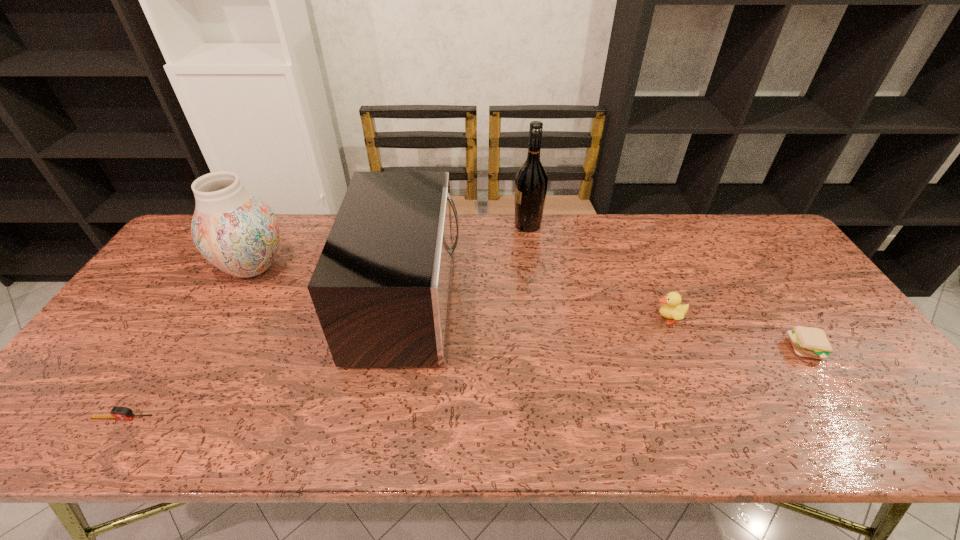
Where is `wine bottle present at the far edge`? The height and width of the screenshot is (540, 960). wine bottle present at the far edge is located at coordinates (531, 181).

The height and width of the screenshot is (540, 960). I want to click on vase at the far edge, so click(237, 232).

Identify the location of microwave oven positioned at the far edge. (381, 288).

Find the location of a particular element. object that is positioned at the near edge is located at coordinates (120, 413).

Locate an element on the screen. object present at the left edge is located at coordinates click(x=120, y=413).

The height and width of the screenshot is (540, 960). Identify the location of object that is at the right edge. (810, 342).

Identify the location of object that is at the near left corner. (120, 413).

Locate an element on the screen. free region at the far edge of the desktop is located at coordinates (565, 242).

Where is `free region at the near edge of the desktop`? The image size is (960, 540). free region at the near edge of the desktop is located at coordinates (200, 445).

Identify the location of free space at the left edge of the desktop. Image resolution: width=960 pixels, height=540 pixels. (128, 390).